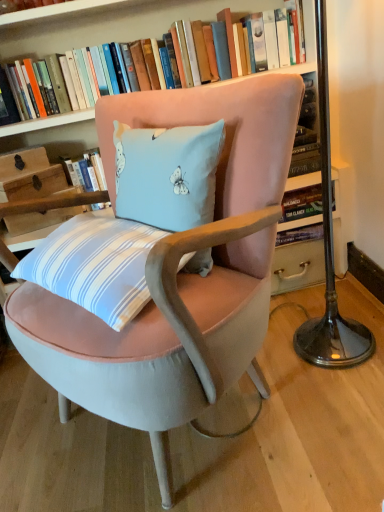
This screenshot has height=512, width=384. Find the location of `metallic base at right`. metallic base at right is located at coordinates (330, 251).

In order to face metallic base at right, should I rotate leftwards or rightwards?

A 17.515 degree turn to the right will do.

The image size is (384, 512). Identify the location of metallic base at right. (330, 251).

Is metallic base at right positioned with its back to hardcover book at upper center?

metallic base at right is not turned away from hardcover book at upper center.

Considering the points (326, 157) and (121, 41), which point is in front, point (326, 157) or point (121, 41)?

The point (326, 157) is closer.

From a real-world perspective, does metallic base at right stand above hardcover book at upper center?

No, from a real-world perspective, metallic base at right is not above hardcover book at upper center.

Can you tell me how much metallic base at right and velvet pink chair at center differ in facing direction?

36.9 degrees separate the facing orientations of metallic base at right and velvet pink chair at center.

Between metallic base at right and velvet pink chair at center, which one appears on the right side from the viewer's perspective?

metallic base at right is more to the right.

Can you confirm if metallic base at right is thinner than velvet pink chair at center?

Yes.

Is metallic base at right aimed at velvet pink chair at center?

Yes, metallic base at right is oriented towards velvet pink chair at center.

Which point is more forward, [82,114] or [356,322]?

The point [356,322] is in front.

Who is smaller, hardcover book at upper center or metallic base at right?

hardcover book at upper center is smaller.

From the image's perspective, which one is positioned lower, hardcover book at upper center or metallic base at right?

metallic base at right, from the image's perspective.

How far apart are hardcover book at upper center and metallic base at right?

69.81 centimeters.

Is hardcover book at upper center in front of or behind velvet pink chair at center in the image?

Visually, hardcover book at upper center is located behind velvet pink chair at center.

Can velvet pink chair at center be found inside hardcover book at upper center?

No.

From the image's perspective, does hardcover book at upper center appear lower than velvet pink chair at center?

No, from the image's perspective, hardcover book at upper center is not beneath velvet pink chair at center.

From a real-world perspective, is velvet pink chair at center positioned under hardcover book at upper center based on gravity?

Yes.

From the image's perspective, which one is positioned lower, velvet pink chair at center or hardcover book at upper center?

velvet pink chair at center, from the image's perspective.

How different are the orientations of velvet pink chair at center and hardcover book at upper center in degrees?

There is a 51.1-degree angle between the facing directions of velvet pink chair at center and hardcover book at upper center.

Considering the sizes of velvet pink chair at center and hardcover book at upper center in the image, is velvet pink chair at center wider or thinner than hardcover book at upper center?

Considering their sizes, velvet pink chair at center looks broader than hardcover book at upper center.

Is velvet pink chair at center spatially inside metallic base at right, or outside of it?

velvet pink chair at center is located beyond the bounds of metallic base at right.

Which object is further away from the camera taking this photo, velvet pink chair at center or metallic base at right?

metallic base at right is more distant.

Considering the relative sizes of velvet pink chair at center and metallic base at right in the image provided, is velvet pink chair at center bigger than metallic base at right?

Yes, velvet pink chair at center is bigger than metallic base at right.

How different are the orientations of velvet pink chair at center and metallic base at right in degrees?

36.9 degrees.

Image resolution: width=384 pixels, height=512 pixels. I want to click on table lamp lying below the hardcover book at upper center (from the image's perspective), so click(330, 251).

You are a GUI agent. You are given a task and a screenshot of the screen. Output one action in this format:
    pyautogui.click(x=<x>, y=<y>)
    Task: Click on the table lamp lying on the right of velvet pink chair at center
    Image resolution: width=384 pixels, height=512 pixels.
    Given the screenshot: What is the action you would take?
    pyautogui.click(x=330, y=251)

Estimate the real-world distances between objects in this image. Which object is further from hardcover book at upper center, velvet pink chair at center or metallic base at right?

velvet pink chair at center.

When comparing their distances from metallic base at right, does velvet pink chair at center or hardcover book at upper center seem further?

hardcover book at upper center.

From the picture: Based on their spatial positions, is hardcover book at upper center or velvet pink chair at center further from metallic base at right?

Result: hardcover book at upper center is further to metallic base at right.

Considering their positions, is metallic base at right positioned further to hardcover book at upper center than velvet pink chair at center?

The object further to hardcover book at upper center is velvet pink chair at center.

Looking at the image, which one is located further to velvet pink chair at center, hardcover book at upper center or metallic base at right?

hardcover book at upper center is positioned further to the anchor velvet pink chair at center.

Based on their spatial positions, is metallic base at right or hardcover book at upper center further from velvet pink chair at center?

hardcover book at upper center is further to velvet pink chair at center.

The width and height of the screenshot is (384, 512). Find the location of `table lamp positioned between velvet pink chair at center and hardcover book at upper center from near to far`. table lamp positioned between velvet pink chair at center and hardcover book at upper center from near to far is located at coordinates (330, 251).